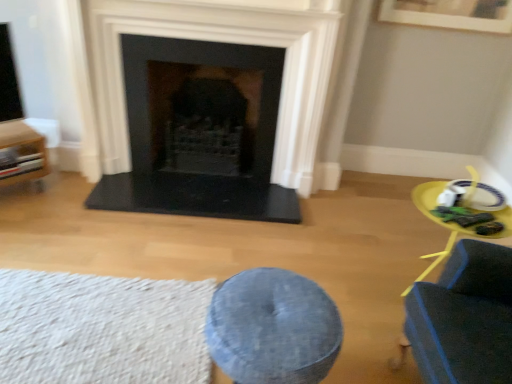
Identify the location of vacant area located to the right-hand side of black stone fireplace at center. (357, 236).